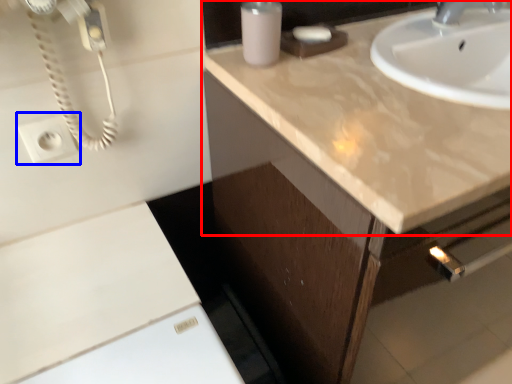
Question: Which object appears closest to the camera in this image, countertop (highlighted by a red box) or electric outlet (highlighted by a blue box)?

Choices:
 (A) countertop
 (B) electric outlet

Answer: (A)